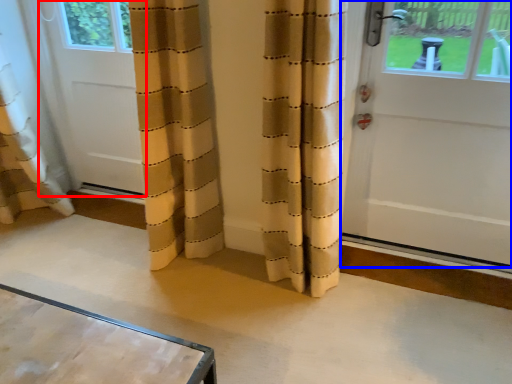
Question: Among these objects, which one is nearest to the camera, door (highlighted by a red box) or door (highlighted by a blue box)?

Choices:
 (A) door
 (B) door

Answer: (B)